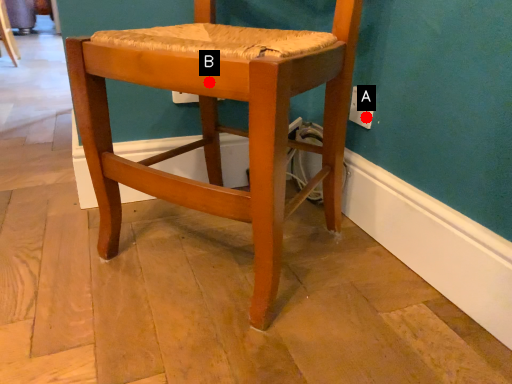
Question: Two points are circled on the image, labeled by A and B beside each circle. Which point is closer to the camera?

Choices:
 (A) A is closer
 (B) B is closer

Answer: (B)